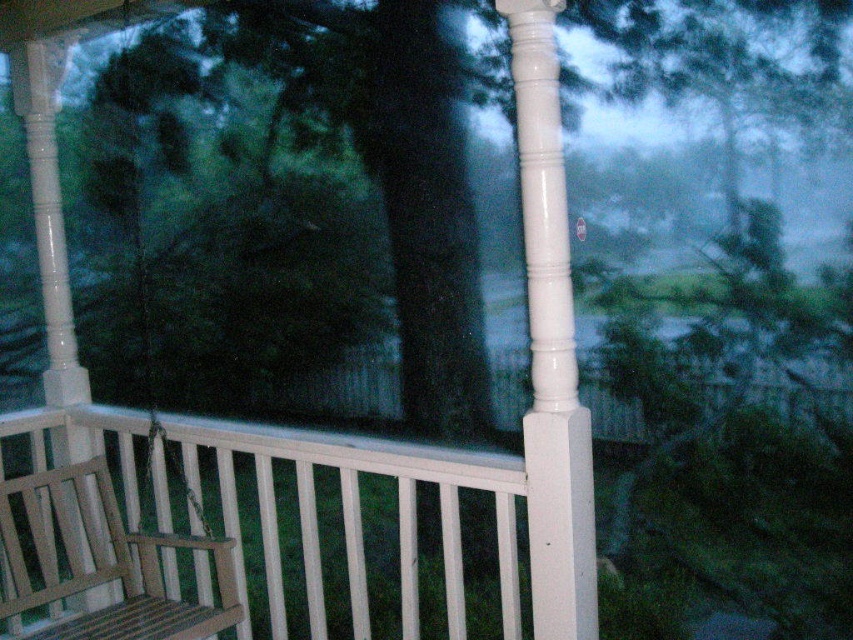
You are standing inside the house and looking through the window at the porch. Where is the white painted wooden post at center in relation to the window frame?

The white painted wooden post at center is located at point coordinates of 0.541 on the x axis and 0.646 on the y axis.

You are an interior designer assessing the space for a new piece of furniture. You have a narrow side table that is 10 cm wide. You need to place it between the white painted wooden post at center and the teak wood rocking chair at lower left. Can the side table fit in that space?

The white painted wooden post at center is thinner than the teak wood rocking chair at lower left. Since the side table is 10 cm wide, it can fit between them as long as the space between the two objects is at least 10 cm. However, without knowing the exact distance between them, we cannot confirm for certain. The question should be rephrased to ask if the space between the two objects is at least 10 cm wide.